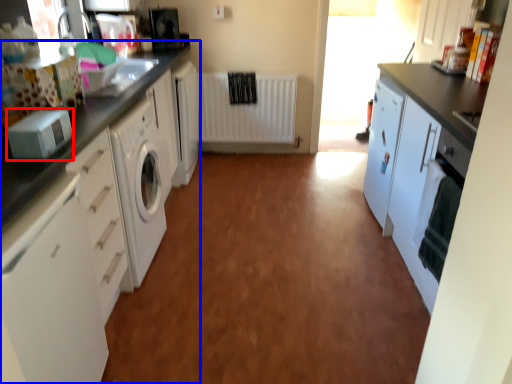
Question: Which of the following is the closest to the observer, appliance (highlighted by a red box) or cabinetry (highlighted by a blue box)?

Choices:
 (A) appliance
 (B) cabinetry

Answer: (A)